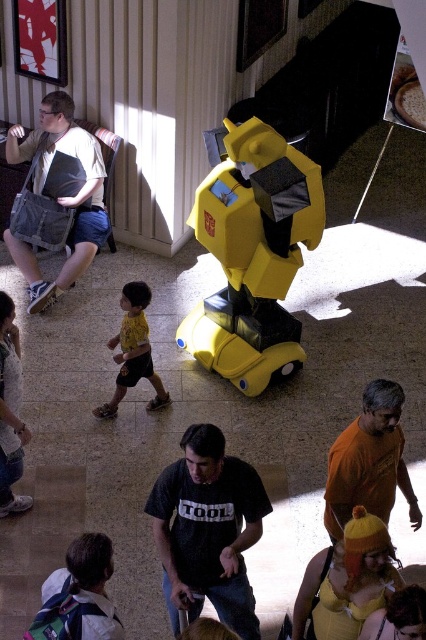
Question: Which object is farther from the camera taking this photo?

Choices:
 (A) white cotton shirt at lower left
 (B) orange matte shirt at lower right

Answer: (B)

Question: Which is nearer to the yellow matte shirt at center?

Choices:
 (A) black cotton shirt at center
 (B) yellow matte robot at center

Answer: (B)

Question: Is yellow matte robot at center wider than matte gray bag at left?

Choices:
 (A) yes
 (B) no

Answer: (A)

Question: Which object is farther from the camera taking this photo?

Choices:
 (A) matte gray bag at left
 (B) orange matte shirt at lower right

Answer: (A)

Question: Does black cotton shirt at center come behind matte gray bag at left?

Choices:
 (A) yes
 (B) no

Answer: (B)

Question: Can you confirm if yellow matte robot at center is positioned above matte gray bag at left?

Choices:
 (A) yes
 (B) no

Answer: (B)